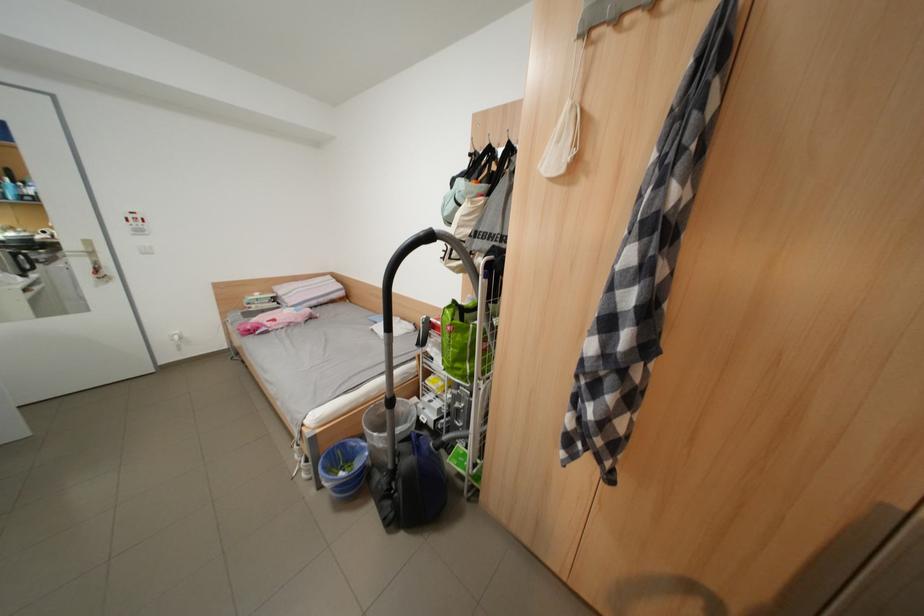
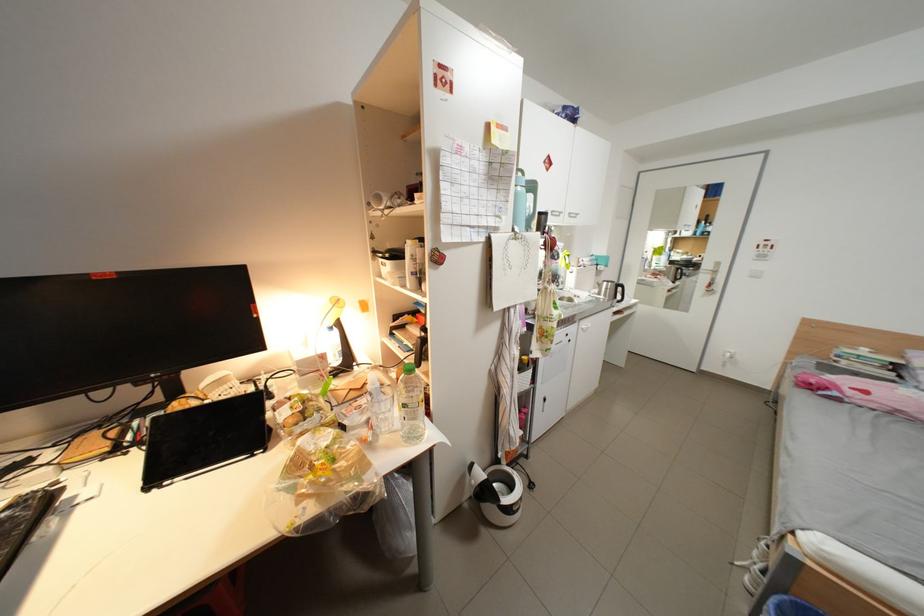
Find the pixel in the second image that matches point 264,307 in the first image.

(856, 363)